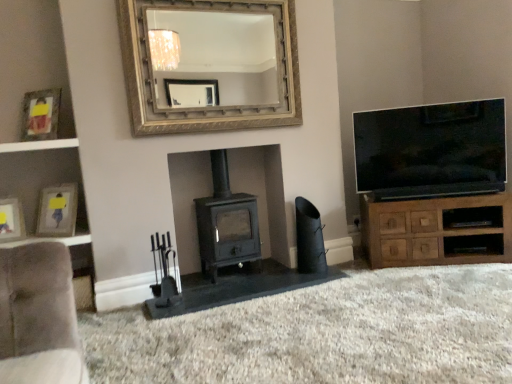
Identify the location of free space in front of black matte speaker at lower right. (306, 279).